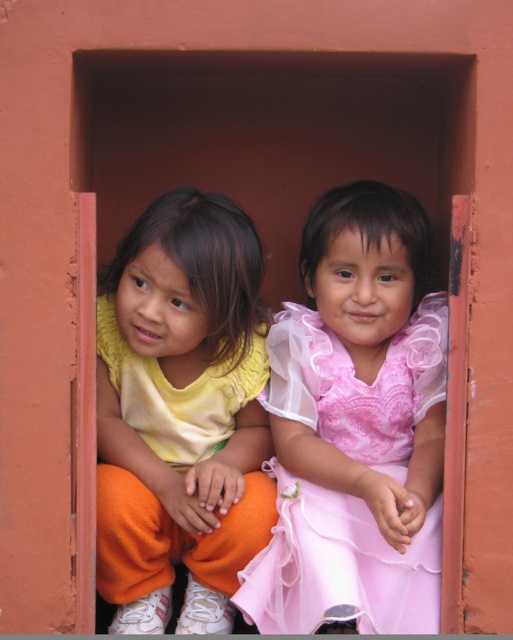
Question: Among these objects, which one is nearest to the camera?

Choices:
 (A) pink sheer dress at center
 (B) matte yellow shirt at left

Answer: (A)

Question: Is matte yellow shirt at left thinner than pink sheer dress at center?

Choices:
 (A) yes
 (B) no

Answer: (A)

Question: Is matte yellow shirt at left smaller than pink sheer dress at center?

Choices:
 (A) yes
 (B) no

Answer: (A)

Question: Is matte yellow shirt at left to the right of pink sheer dress at center from the viewer's perspective?

Choices:
 (A) yes
 (B) no

Answer: (B)

Question: Among these objects, which one is farthest from the camera?

Choices:
 (A) pink sheer dress at center
 (B) matte yellow shirt at left

Answer: (B)